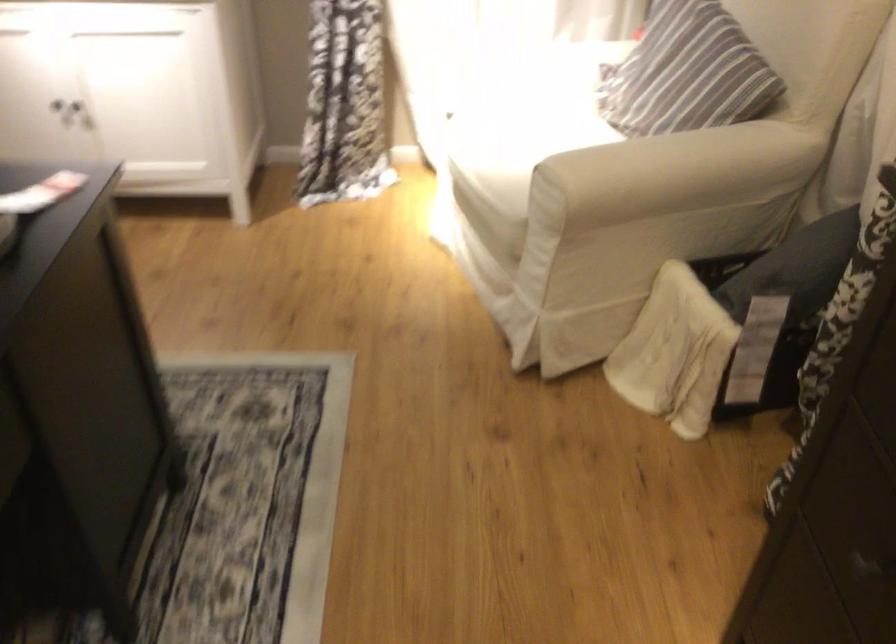
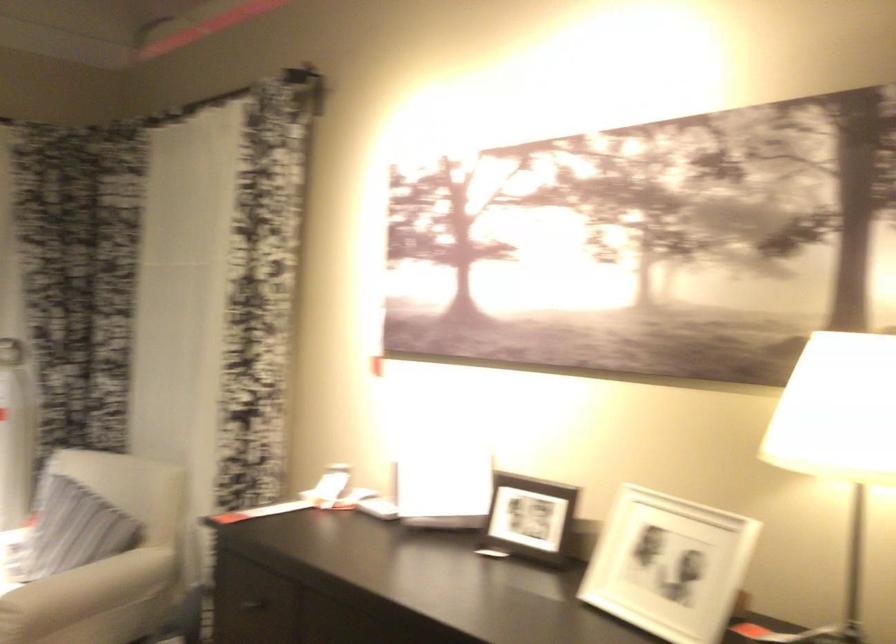
Locate, in the second image, the point that corresponds to point (652, 180) in the first image.

(85, 592)